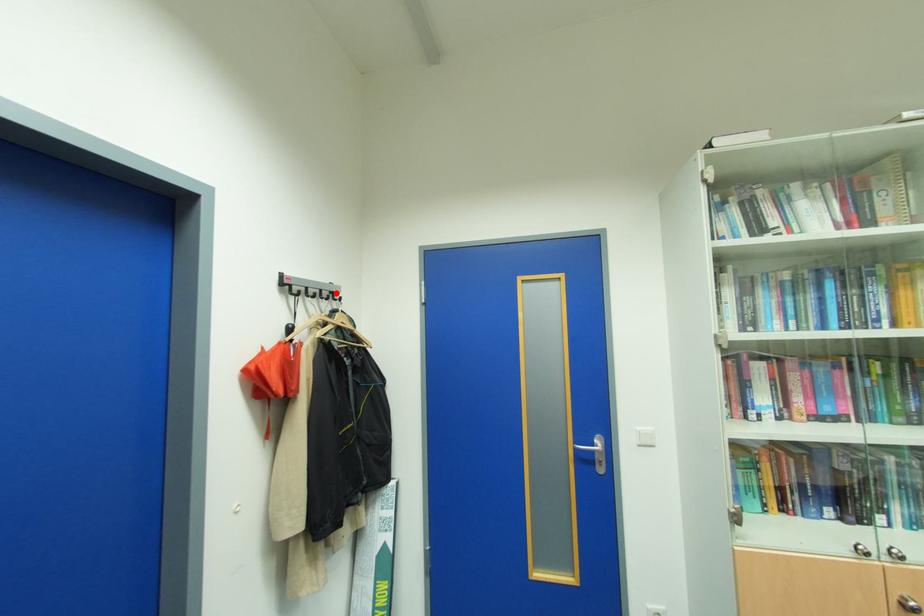
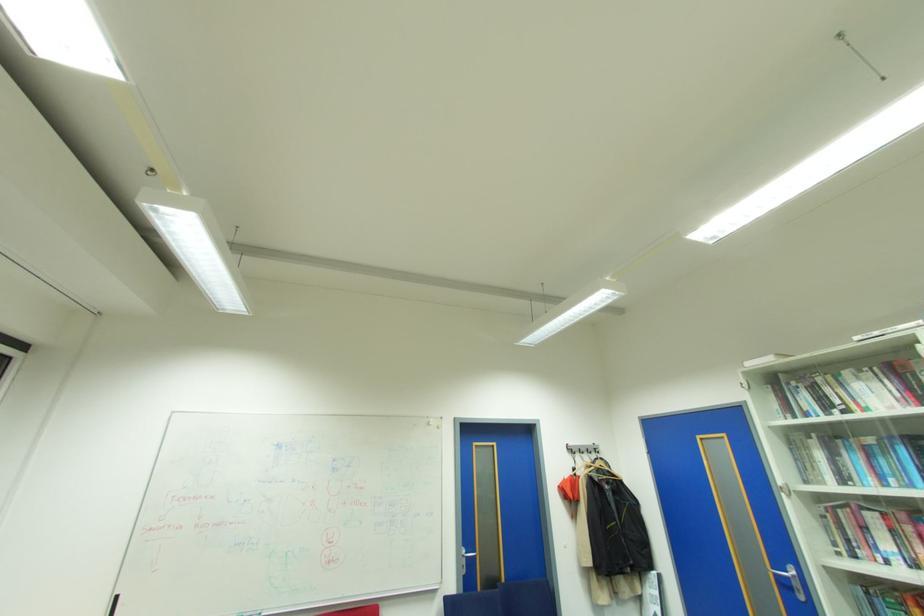
Where in the second image is the point corresponding to the highlighted location from the first image?

(600, 448)